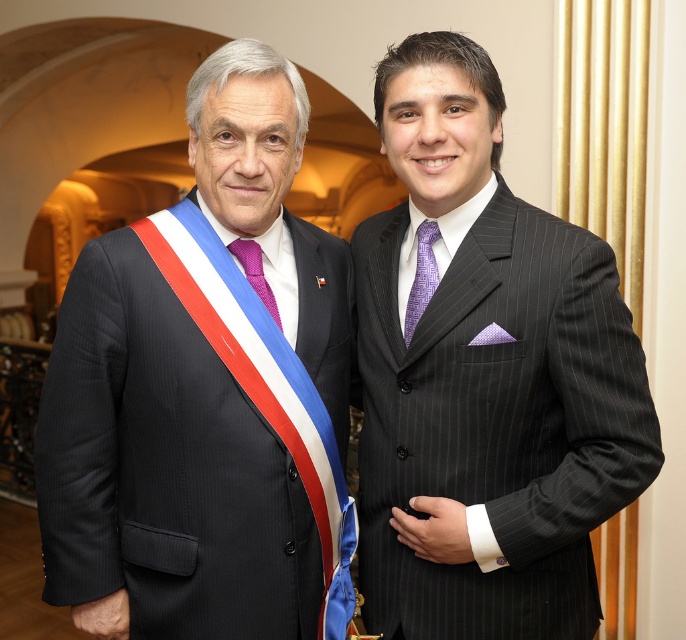
Where is the purple silk tie at center located in the image?

The purple silk tie at center is located at point [421,276] in the image.

You are a photographer adjusting a backdrop for a formal event. The backdrop needs to accommodate both the matte black suit at left and the purple silk tie at center. Which object requires a wider space on the backdrop?

The matte black suit at left requires a wider space on the backdrop because its width is larger than the purple silk tie at center.

You are a photographer adjusting your camera settings. You want to focus on the matte black suit at left and the purple knitted tie at center. Which object should you adjust the focus on first if you want to ensure both are in sharp focus?

The matte black suit at left is closer to the viewer than the purple knitted tie at center. To ensure both are in sharp focus, you should focus on the object that is further away first, which is the purple knitted tie at center, as focusing on the further object in a scene with depth can help maximize the depth of field for both subjects.